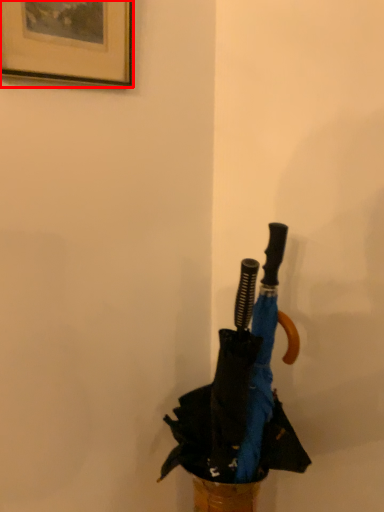
Question: From the image's perspective, where is picture frame (annotated by the red box) located in relation to umbrella in the image?

Choices:
 (A) below
 (B) above

Answer: (B)